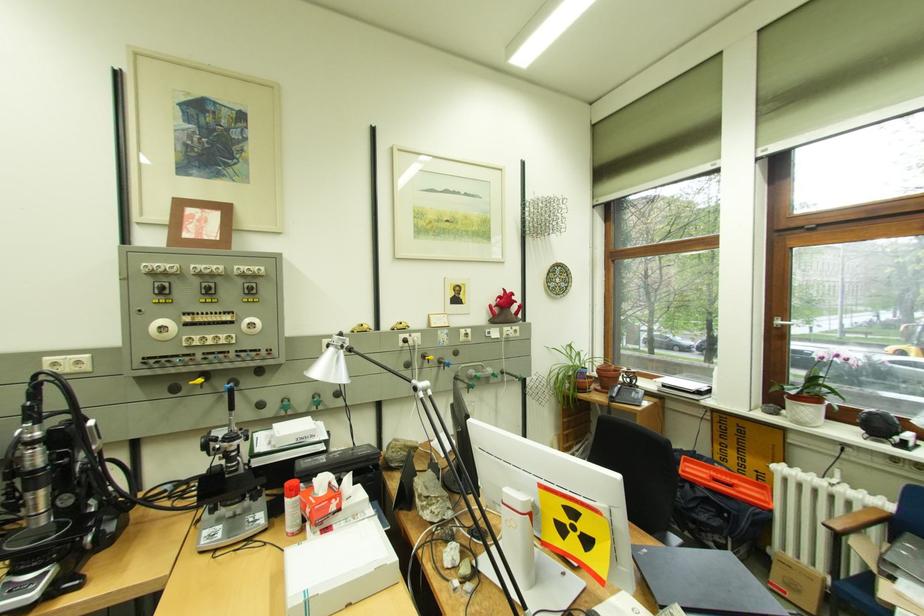
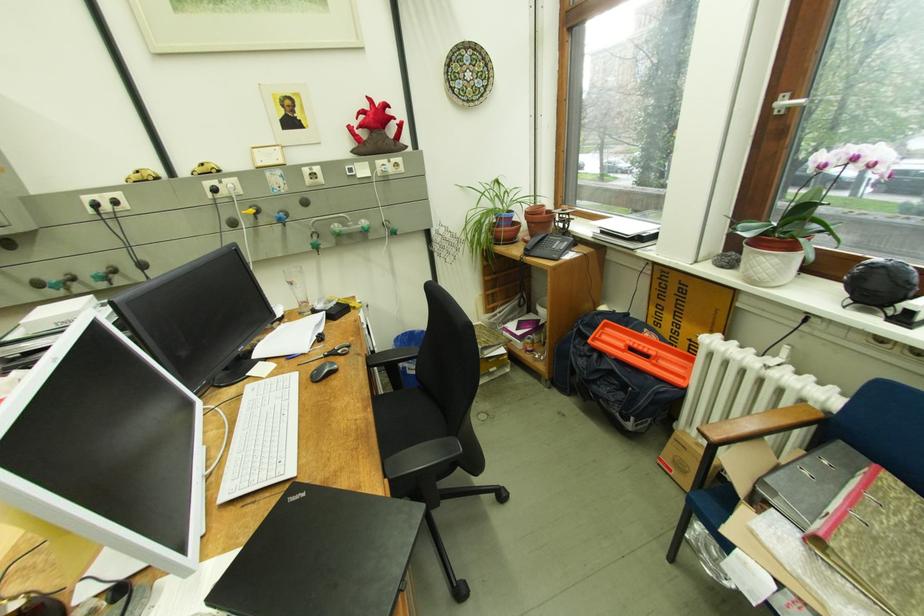
Where in the second image is the point corresponding to (x=725, y=480) from the first image?

(641, 351)